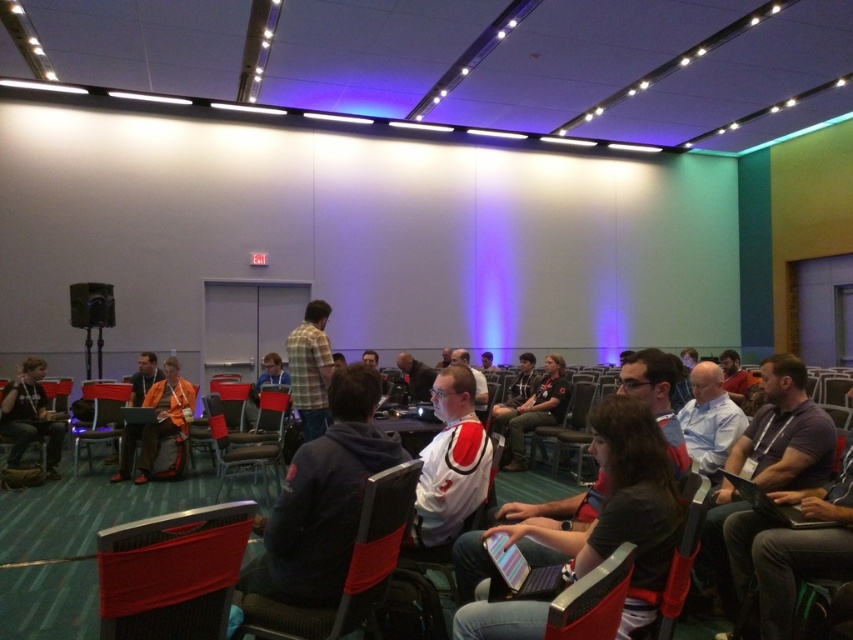
Question: Which object is closer to the camera taking this photo?

Choices:
 (A) orange fabric jacket at center
 (B) metallic silver speaker at left
 (C) black plastic laptop at lower right

Answer: (C)

Question: Can you confirm if red fabric chair at lower left is smaller than white jersey at center?

Choices:
 (A) yes
 (B) no

Answer: (A)

Question: Does plaid shirt at center have a lesser width compared to matte black hoodie at left?

Choices:
 (A) yes
 (B) no

Answer: (A)

Question: Among these points, which one is farthest from the camera?

Choices:
 (A) (169, 609)
 (B) (312, 356)
 (C) (532, 435)

Answer: (C)

Question: Which object is positioned farthest from the red fabric chair at center?

Choices:
 (A) white jersey at center
 (B) dark gray fabric jacket at center
 (C) matte black hoodie at left

Answer: (A)

Question: Does black fabric chair at center have a greater width compared to orange fabric jacket at center?

Choices:
 (A) yes
 (B) no

Answer: (B)